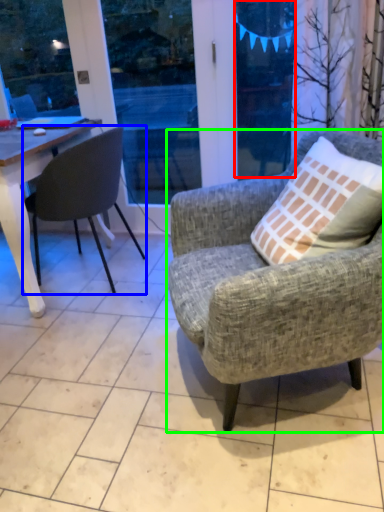
Question: Which object is the farthest from window screen (highlighted by a red box)? Choose among these: chair (highlighted by a blue box) or chair (highlighted by a green box).

Choices:
 (A) chair
 (B) chair

Answer: (B)